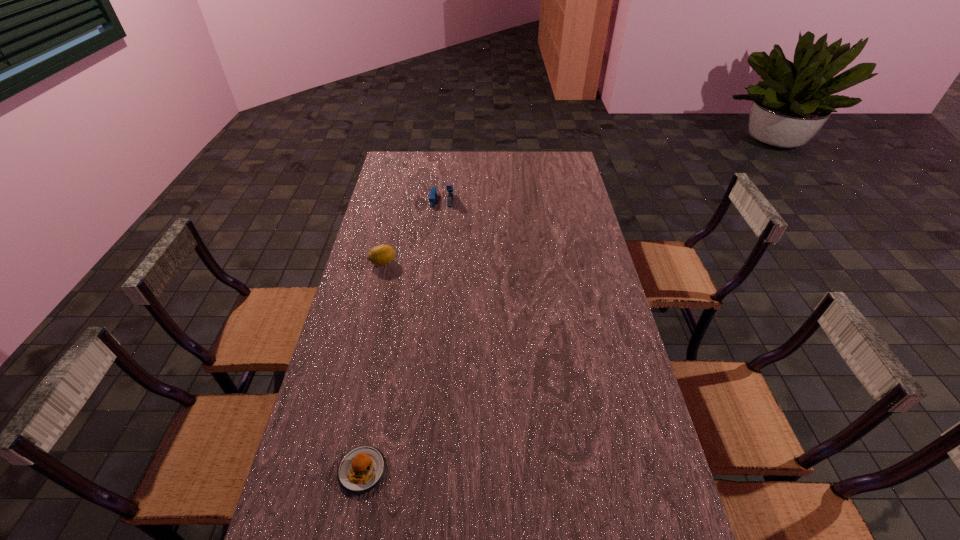
Where is `food that is at the left edge`? food that is at the left edge is located at coordinates (361, 469).

The width and height of the screenshot is (960, 540). In order to click on vacant space at the far edge of the desktop in this screenshot , I will do `click(511, 153)`.

Identify the location of vacant space at the left edge. (387, 180).

Where is `vacant space at the right edge`? The height and width of the screenshot is (540, 960). vacant space at the right edge is located at coordinates (590, 369).

Identify the location of blank space at the far left corner. The height and width of the screenshot is (540, 960). (405, 158).

I want to click on free point at the far right corner, so click(x=565, y=160).

Locate an element on the screen. vacant region between the nearest object and the stapler is located at coordinates (402, 335).

The height and width of the screenshot is (540, 960). Identify the location of vacant area that lies between the second farthest object and the farthest object. (412, 231).

Identify the location of empty location between the farthest object and the food. This screenshot has height=540, width=960. (402, 335).

Identify the location of vacant space that's between the nearest object and the second tallest object. (372, 367).